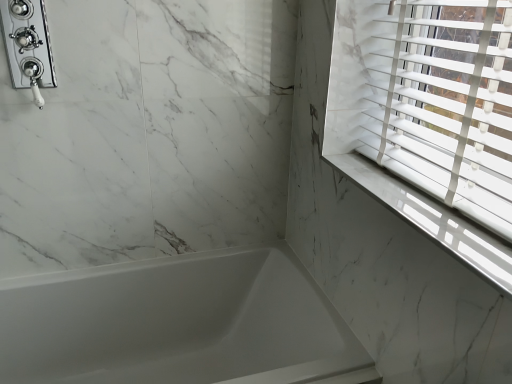
Question: Is chrome/polished metal shower at upper left oriented away from white glossy bathtub at lower left?

Choices:
 (A) no
 (B) yes

Answer: (A)

Question: Is chrome/polished metal shower at upper left closer to the viewer compared to white glossy bathtub at lower left?

Choices:
 (A) yes
 (B) no

Answer: (B)

Question: Is chrome/polished metal shower at upper left to the left of white glossy bathtub at lower left from the viewer's perspective?

Choices:
 (A) no
 (B) yes

Answer: (B)

Question: Is chrome/polished metal shower at upper left bigger than white glossy bathtub at lower left?

Choices:
 (A) no
 (B) yes

Answer: (A)

Question: Is chrome/polished metal shower at upper left wider than white glossy bathtub at lower left?

Choices:
 (A) no
 (B) yes

Answer: (A)

Question: In terms of height, does chrome/polished metal shower at upper left look taller or shorter compared to white glossy bathtub at lower left?

Choices:
 (A) tall
 (B) short

Answer: (B)

Question: In the image, is chrome/polished metal shower at upper left positioned in front of or behind white glossy bathtub at lower left?

Choices:
 (A) front
 (B) behind

Answer: (B)

Question: Do you think chrome/polished metal shower at upper left is within white glossy bathtub at lower left, or outside of it?

Choices:
 (A) inside
 (B) outside

Answer: (B)

Question: From a real-world perspective, relative to white glossy bathtub at lower left, is chrome/polished metal shower at upper left vertically above or below?

Choices:
 (A) above
 (B) below

Answer: (A)

Question: In terms of width, does white glossy bathtub at lower left look wider or thinner when compared to chrome/polished metal shower at upper left?

Choices:
 (A) thin
 (B) wide

Answer: (B)

Question: Considering the relative positions of white glossy bathtub at lower left and chrome/polished metal shower at upper left in the image provided, is white glossy bathtub at lower left to the left or to the right of chrome/polished metal shower at upper left?

Choices:
 (A) right
 (B) left

Answer: (A)

Question: Is white glossy bathtub at lower left bigger or smaller than chrome/polished metal shower at upper left?

Choices:
 (A) small
 (B) big

Answer: (B)

Question: Is white glossy bathtub at lower left in front of or behind chrome/polished metal shower at upper left in the image?

Choices:
 (A) behind
 (B) front

Answer: (B)

Question: Is point (15, 77) positioned closer to the camera than point (468, 231)?

Choices:
 (A) closer
 (B) farther

Answer: (B)

Question: From the image's perspective, is chrome/polished metal shower at upper left located above or below white marble window sill at upper right?

Choices:
 (A) below
 (B) above

Answer: (B)